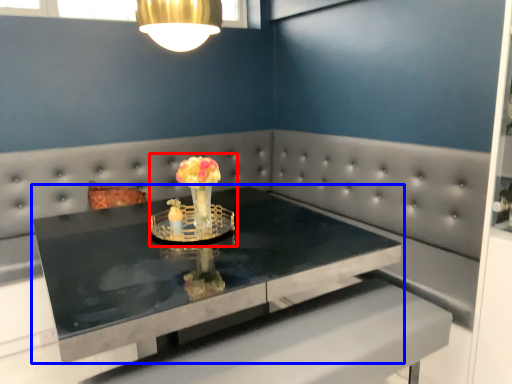
Question: Among these objects, which one is nearest to the camera, floral arrangement (highlighted by a red box) or table (highlighted by a blue box)?

Choices:
 (A) floral arrangement
 (B) table

Answer: (B)